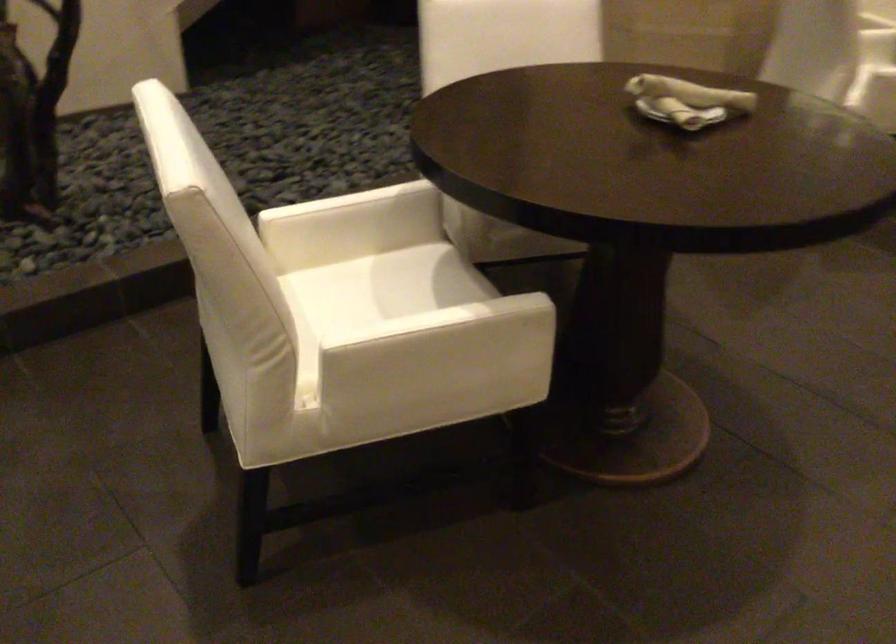
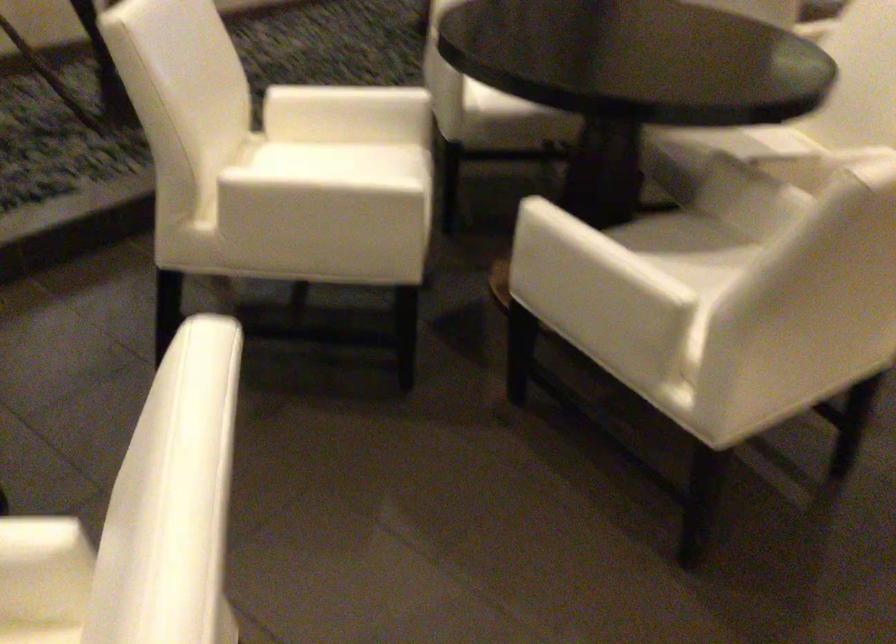
What movement of the cameraman would produce the second image?

The cameraman moved toward left, backward.